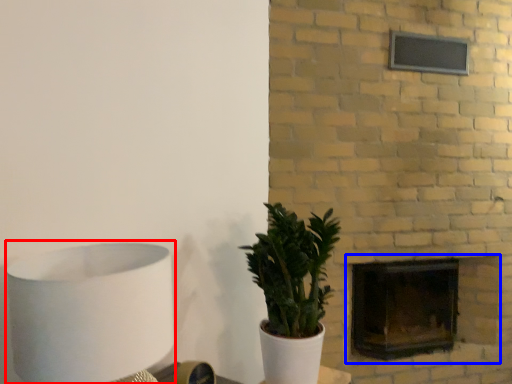
Question: Which object is further to the camera taking this photo, table lamp (highlighted by a red box) or fireplace (highlighted by a blue box)?

Choices:
 (A) table lamp
 (B) fireplace

Answer: (B)